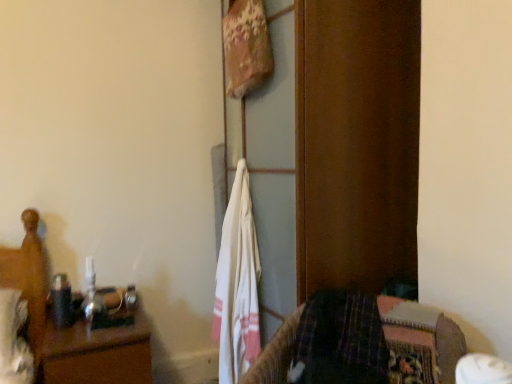
Question: Is wooden bed at left outside of wooden nightstand at left?

Choices:
 (A) yes
 (B) no

Answer: (A)

Question: Does wooden bed at left have a lesser width compared to wooden nightstand at left?

Choices:
 (A) yes
 (B) no

Answer: (A)

Question: Is wooden bed at left wider than wooden nightstand at left?

Choices:
 (A) no
 (B) yes

Answer: (A)

Question: Can you confirm if wooden bed at left is bigger than wooden nightstand at left?

Choices:
 (A) yes
 (B) no

Answer: (B)

Question: Can you confirm if wooden bed at left is positioned to the left of wooden nightstand at left?

Choices:
 (A) no
 (B) yes

Answer: (B)

Question: Is wooden bed at left not close to wooden nightstand at left?

Choices:
 (A) no
 (B) yes

Answer: (A)

Question: Is white cotton towel at center facing away from wooden bed at left?

Choices:
 (A) yes
 (B) no

Answer: (B)

Question: From a real-world perspective, is white cotton towel at center physically below wooden bed at left?

Choices:
 (A) no
 (B) yes

Answer: (A)

Question: Is white cotton towel at center thinner than wooden bed at left?

Choices:
 (A) no
 (B) yes

Answer: (B)

Question: Is wooden bed at left surrounded by white cotton towel at center?

Choices:
 (A) yes
 (B) no

Answer: (B)

Question: From a real-world perspective, is white cotton towel at center on wooden bed at left?

Choices:
 (A) yes
 (B) no

Answer: (A)

Question: Is white cotton towel at center shorter than wooden bed at left?

Choices:
 (A) yes
 (B) no

Answer: (B)

Question: Does wooden bed at left appear on the left side of plaid fabric bedspread at lower right?

Choices:
 (A) yes
 (B) no

Answer: (A)